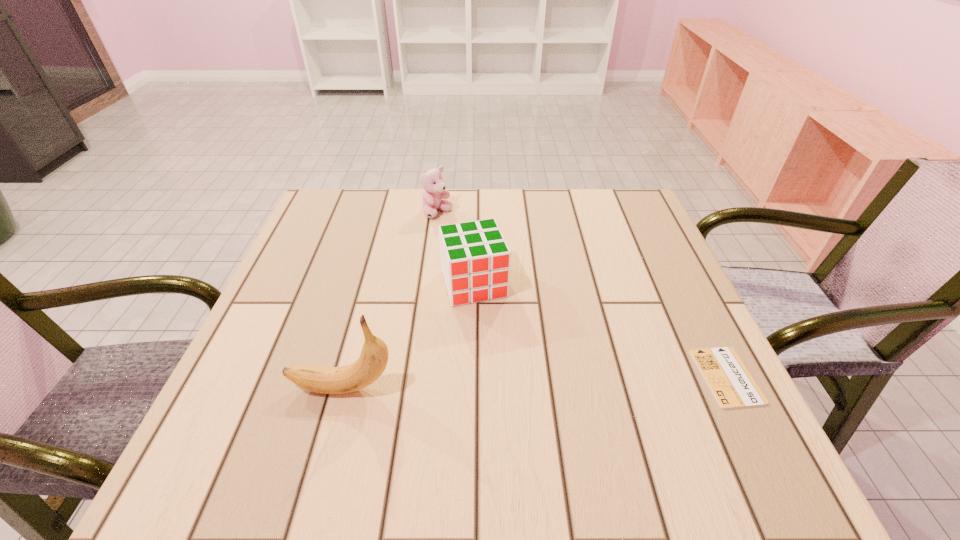
Identify the location of the tallest object. (373, 359).

At what (x,y) coordinates should I click in order to perform the action: click on the rightmost object. Please return your answer as a coordinate pair (x, y). Looking at the image, I should click on (732, 385).

The width and height of the screenshot is (960, 540). I want to click on the shortest object, so click(732, 385).

Identify the location of teddy bear. (434, 191).

Where is `the second farthest object`? The height and width of the screenshot is (540, 960). the second farthest object is located at coordinates (475, 259).

Identify the location of vacant space situated 0.080m at the start of the peel on the tallest object. (244, 388).

The width and height of the screenshot is (960, 540). Find the location of `vacant area situated 0.080m at the start of the peel on the tallest object`. vacant area situated 0.080m at the start of the peel on the tallest object is located at coordinates (244, 388).

The width and height of the screenshot is (960, 540). Find the location of `vacant space located at the start of the peel on the tallest object`. vacant space located at the start of the peel on the tallest object is located at coordinates (238, 388).

At what (x,y) coordinates should I click in order to perform the action: click on free point located 0.350m on the back of the identity card. Please return your answer as a coordinate pair (x, y). The image size is (960, 540). Looking at the image, I should click on (659, 238).

The width and height of the screenshot is (960, 540). I want to click on blank space located 0.280m at the face of the farthest object, so click(485, 288).